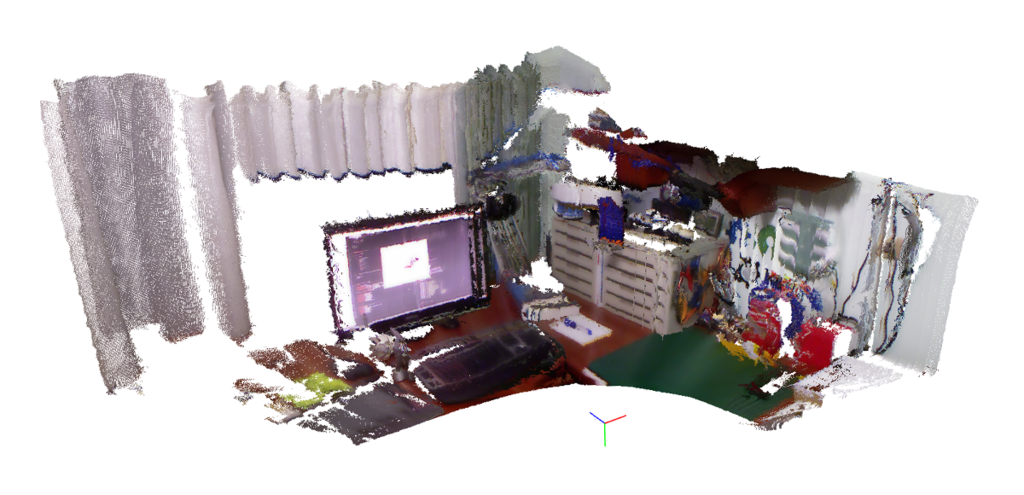
The width and height of the screenshot is (1024, 495). I want to click on abstract computer room detailed image, so click(x=140, y=204), click(x=334, y=127), click(x=532, y=229), click(x=430, y=359), click(x=666, y=364), click(x=667, y=197), click(x=890, y=267).